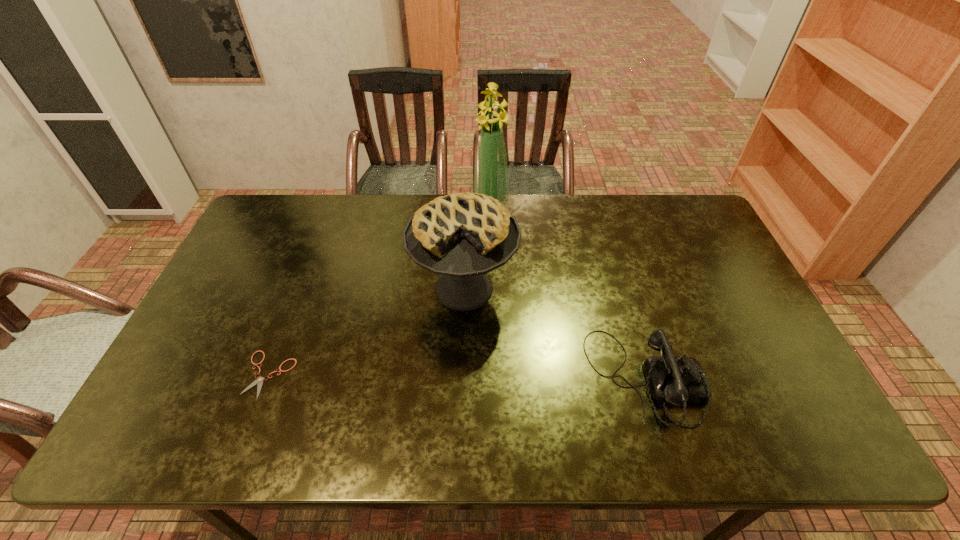
The width and height of the screenshot is (960, 540). Find the location of `vacant space that is in between the telephone and the pie`. vacant space that is in between the telephone and the pie is located at coordinates (555, 334).

The height and width of the screenshot is (540, 960). I want to click on vacant space that is in between the rightmost object and the shears, so click(x=458, y=377).

You are a GUI agent. You are given a task and a screenshot of the screen. Output one action in this format:
    pyautogui.click(x=<x>, y=<y>)
    Task: Click on the free spot between the second tallest object and the telephone
    Image resolution: width=960 pixels, height=540 pixels.
    Given the screenshot: What is the action you would take?
    pyautogui.click(x=555, y=334)

Locate an element on the screen. The width and height of the screenshot is (960, 540). free space that is in between the telephone and the leftmost object is located at coordinates (458, 377).

This screenshot has width=960, height=540. In order to click on vacant space that's between the bouquet and the telephone in this screenshot , I will do `click(568, 293)`.

At what (x,y) coordinates should I click in order to perform the action: click on free space between the rightmost object and the shortest object. Please return your answer as a coordinate pair (x, y). The width and height of the screenshot is (960, 540). Looking at the image, I should click on (458, 377).

Find the location of a particular element. The height and width of the screenshot is (540, 960). object that stands as the second closest to the rightmost object is located at coordinates (491, 175).

You are a GUI agent. You are given a task and a screenshot of the screen. Output one action in this format:
    pyautogui.click(x=<x>, y=<y>)
    Task: Click on the object identified as the closest to the leftmost object
    This screenshot has height=540, width=960.
    Given the screenshot: What is the action you would take?
    pyautogui.click(x=462, y=236)

Where is `vacant space that satisfies the following two spatial constraints: 1. on the front side of the tallest object; 2. on the front-facing side of the third tallest object`? The image size is (960, 540). vacant space that satisfies the following two spatial constraints: 1. on the front side of the tallest object; 2. on the front-facing side of the third tallest object is located at coordinates (495, 380).

Find the location of a particular element. The height and width of the screenshot is (540, 960). vacant region that satisfies the following two spatial constraints: 1. on the front side of the telephone; 2. on the front-facing side of the tallest object is located at coordinates (495, 380).